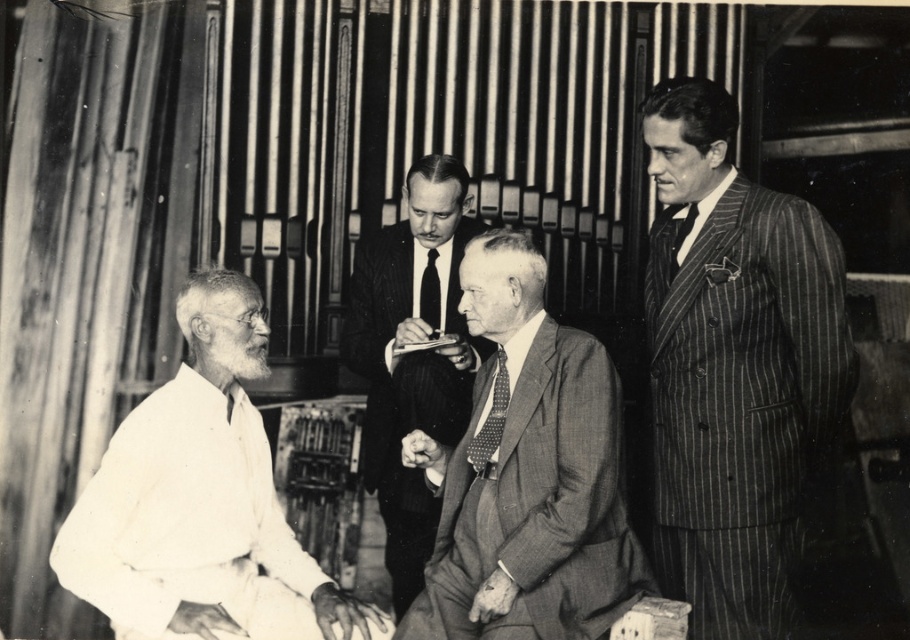
In the formal setting with the organ in the background, there is a man wearing a striped wool suit at right and another wearing a smooth black suit at center. Which of these two suits is wider?

The striped wool suit at right is wider than the smooth black suit at center.